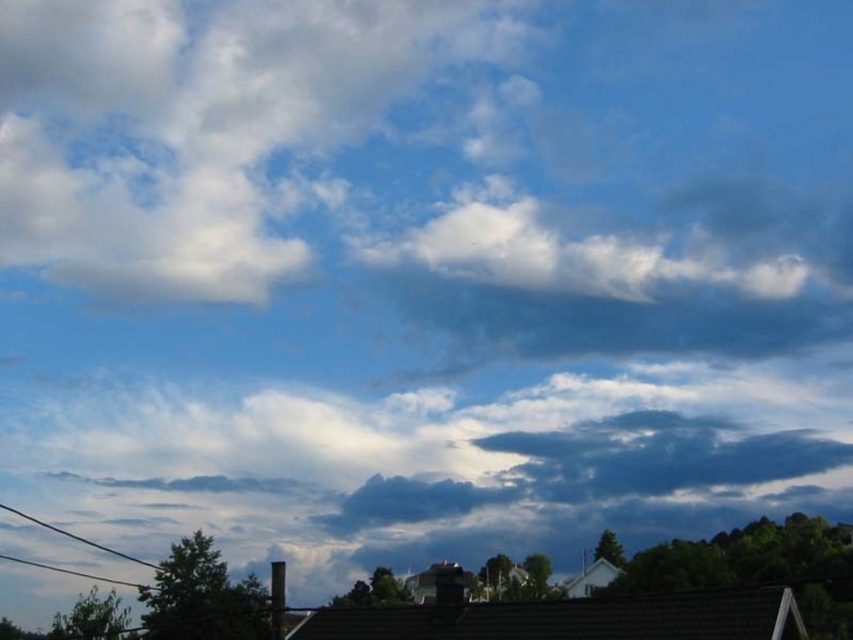
Question: Is white fluffy cloud at upper center in front of black wire at lower left?

Choices:
 (A) no
 (B) yes

Answer: (A)

Question: Is the position of white fluffy cloud at upper center less distant than that of black wire at lower left?

Choices:
 (A) yes
 (B) no

Answer: (B)

Question: Which point is farther from the camera taking this photo?

Choices:
 (A) (61, 529)
 (B) (184, 168)

Answer: (A)

Question: Which point appears farthest from the camera in this image?

Choices:
 (A) (28, 515)
 (B) (302, 125)

Answer: (A)

Question: In this image, where is white fluffy cloud at upper center located relative to black wire at lower left?

Choices:
 (A) right
 (B) left

Answer: (B)